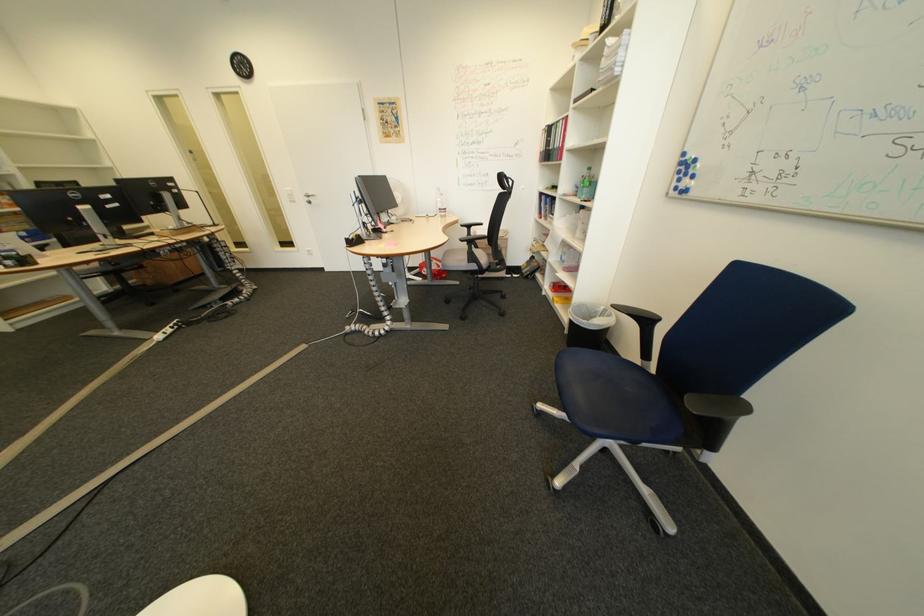
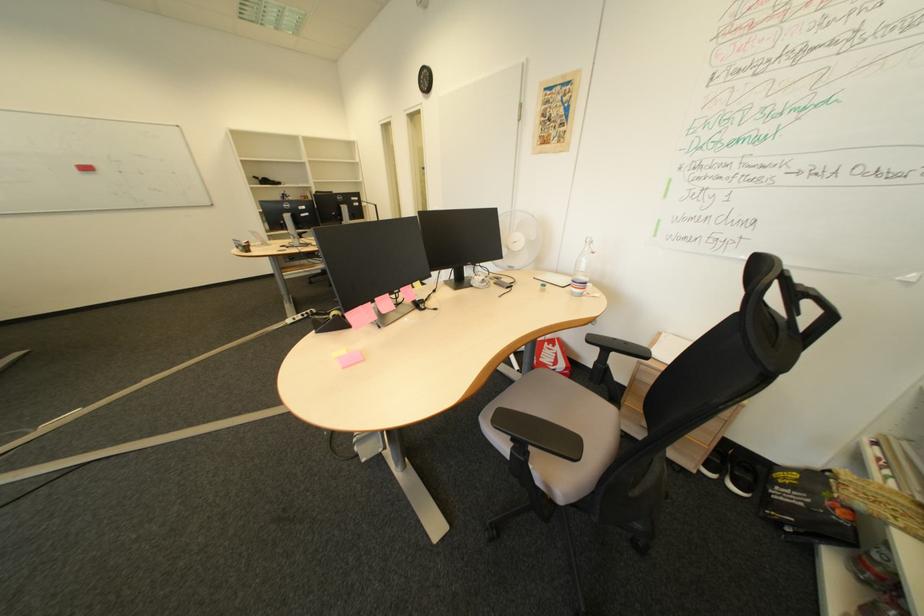
Find the pixel in the second image that matches [113,249] in the first image.

(301, 246)